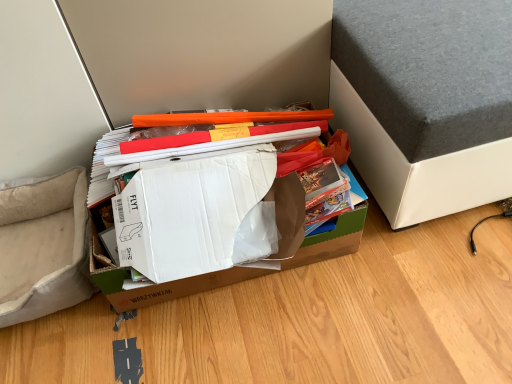
Question: Do you think beige fabric armchair at lower left is within brown cardboard box at center, or outside of it?

Choices:
 (A) outside
 (B) inside

Answer: (A)

Question: Based on their sizes in the image, would you say beige fabric armchair at lower left is bigger or smaller than brown cardboard box at center?

Choices:
 (A) small
 (B) big

Answer: (A)

Question: Based on their relative distances, which object is farther from the brown cardboard box at center?

Choices:
 (A) gray fabric bed at upper right
 (B) beige fabric armchair at lower left

Answer: (A)

Question: Estimate the real-world distances between objects in this image. Which object is closer to the gray fabric bed at upper right?

Choices:
 (A) beige fabric armchair at lower left
 (B) brown cardboard box at center

Answer: (B)